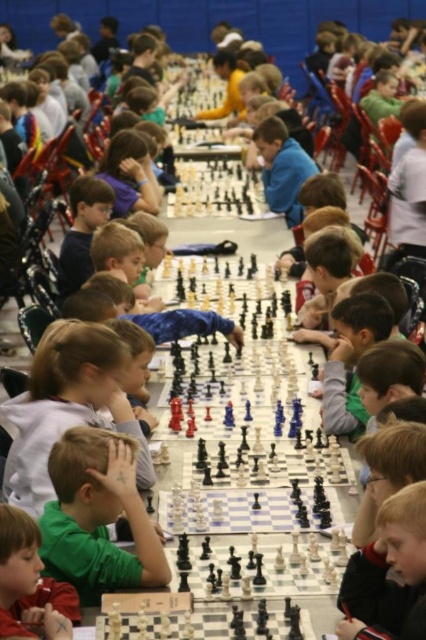
Question: Considering the relative positions of light brown hair at lower right and light brown hair at lower left in the image provided, where is light brown hair at lower right located with respect to light brown hair at lower left?

Choices:
 (A) right
 (B) left

Answer: (A)

Question: Can you confirm if light brown hair at lower right is bigger than light brown hair at lower left?

Choices:
 (A) yes
 (B) no

Answer: (A)

Question: Which object is closer to the camera taking this photo?

Choices:
 (A) green matte shirt at center
 (B) light brown hair at lower right

Answer: (B)

Question: Where is green matte shirt at center located in relation to light brown hair at lower right in the image?

Choices:
 (A) above
 (B) below

Answer: (A)

Question: Which of these objects is positioned closest to the green matte shirt at center?

Choices:
 (A) light brown hair at lower left
 (B) light brown hair at lower right

Answer: (A)

Question: Which object is positioned farthest from the light brown hair at lower left?

Choices:
 (A) green matte shirt at center
 (B) light brown hair at lower right

Answer: (B)